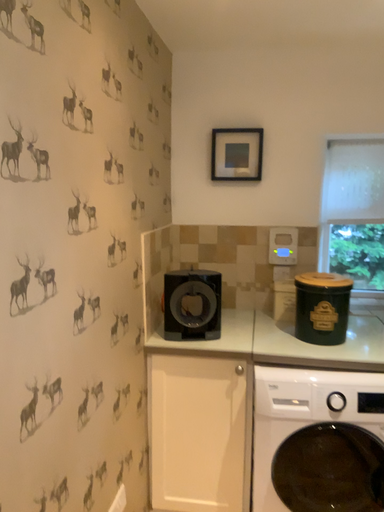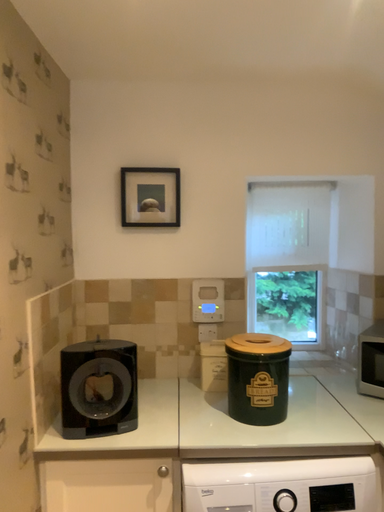
Question: How did the camera likely rotate when shooting the video?

Choices:
 (A) rotated left
 (B) rotated right

Answer: (B)